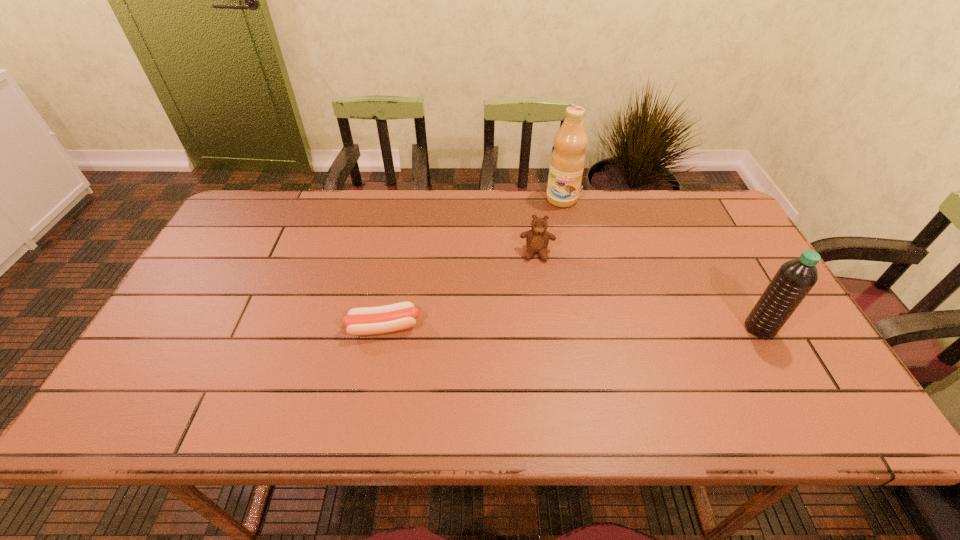
This screenshot has width=960, height=540. In order to click on free spot at the left edge of the desktop in this screenshot , I will do `click(173, 348)`.

In the image, there is a desktop. At what (x,y) coordinates should I click in order to perform the action: click on vacant space at the right edge. Please return your answer as a coordinate pair (x, y). This screenshot has width=960, height=540. Looking at the image, I should click on (758, 352).

This screenshot has height=540, width=960. In order to click on vacant space at the near left corner of the desktop in this screenshot , I will do `click(173, 357)`.

The height and width of the screenshot is (540, 960). What are the coordinates of `vacant space at the far right corner` in the screenshot? It's located at (708, 213).

Locate an element on the screen. This screenshot has width=960, height=540. free point between the second shortest object and the rightmost object is located at coordinates (648, 291).

Image resolution: width=960 pixels, height=540 pixels. Identify the location of empty space between the sausage and the second object from right to left. (472, 263).

This screenshot has height=540, width=960. I want to click on unoccupied position between the sausage and the third tallest object, so click(460, 290).

Image resolution: width=960 pixels, height=540 pixels. What are the coordinates of `free space between the farthest object and the rightmost object` in the screenshot? It's located at (660, 264).

The height and width of the screenshot is (540, 960). Find the location of `free spot between the farthest object and the water bottle`. free spot between the farthest object and the water bottle is located at coordinates (660, 264).

The width and height of the screenshot is (960, 540). In order to click on empty space that is in between the rightmost object and the second shortest object in this screenshot , I will do `click(648, 291)`.